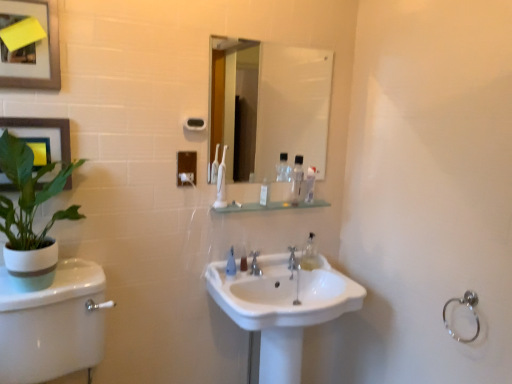
Image resolution: width=512 pixels, height=384 pixels. Find the location of `vacant space underneath transparent glass shelf at center (from a real-world perspective)`. vacant space underneath transparent glass shelf at center (from a real-world perspective) is located at coordinates (265, 260).